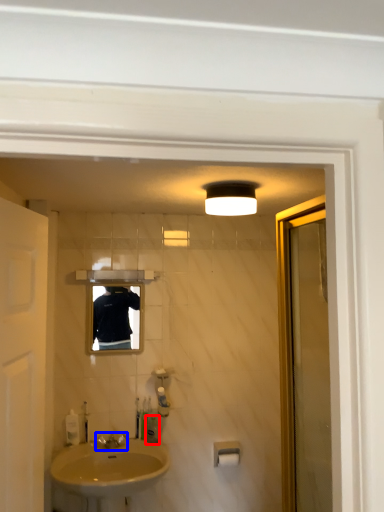
Question: Which object appears farthest to the camera in this image, toiletry (highlighted by a red box) or tap (highlighted by a blue box)?

Choices:
 (A) toiletry
 (B) tap

Answer: (A)